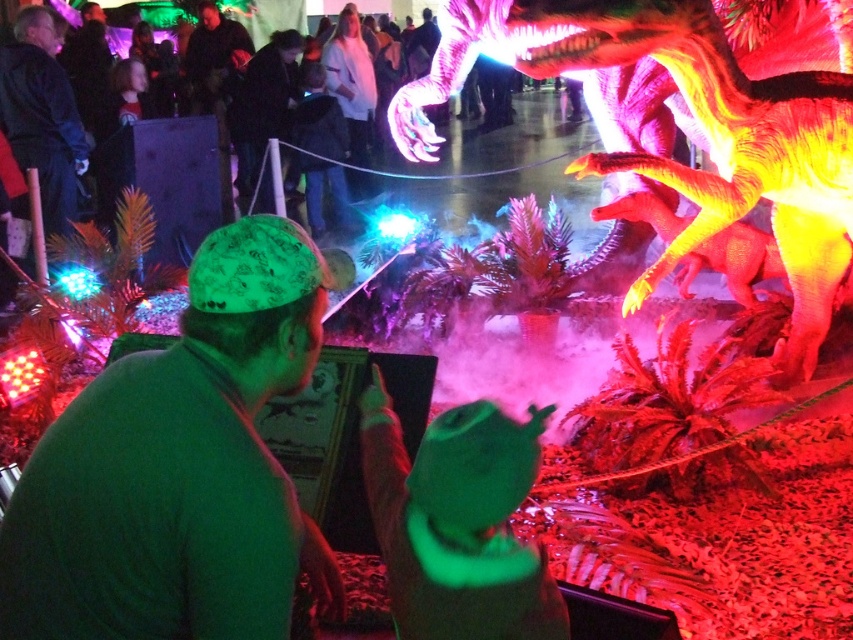
You are a photographer trying to capture a clear photo of the green fabric cap at center and the dark gray fabric jacket at center. Since you can only focus on one object at a time, which one should you focus on to ensure it appears sharp in the photo?

You should focus on the green fabric cap at center because it is closer to the viewer than the dark gray fabric jacket at center, so focusing on it will keep it sharp while the jacket may appear slightly blurry.

In the scene shown: You are standing at the point marked as point (x=146, y=355) in the image. The camera is 1.22 meters away from you. If you want to take a photo of the dinosaur model on the right side, will you be able to see it in your camera view?

Yes, since the camera is 1.22 meters away from you at point (x=146, y=355), and the dinosaur model is on the right side of the frame, you would be able to see it in your camera view as long as there are no obstructions between you and the dinosaur.

Looking at this image, you are a visitor at the dinosaur exhibit. You see the shiny plastic dinosaur at center and the two people in green shirts and caps. How far apart are they?

The two people in green shirts and caps and the shiny plastic dinosaur at center are 2.29 meters apart.